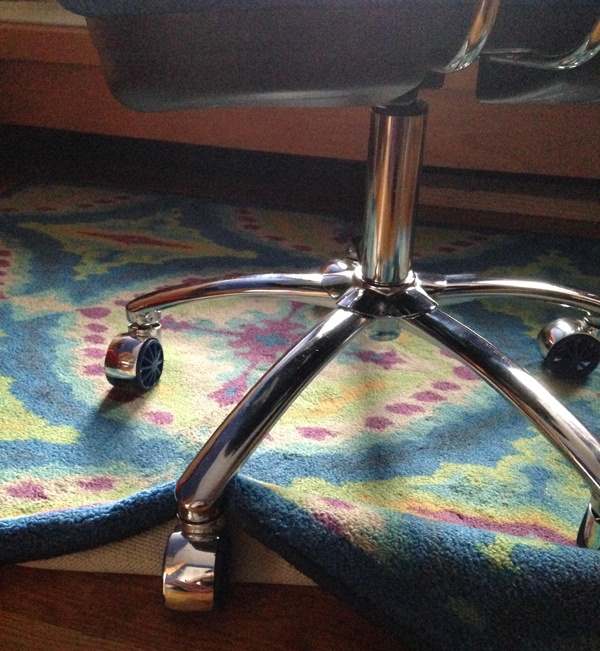
Locate an element on the screen. wood floor is located at coordinates (87, 626).